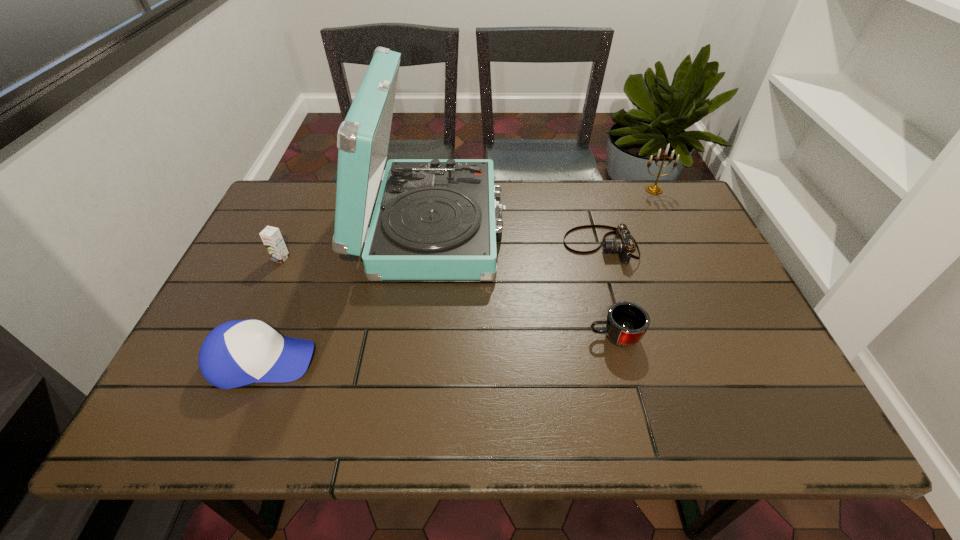
Image resolution: width=960 pixels, height=540 pixels. In order to click on the tallest object in this screenshot , I will do `click(435, 219)`.

Identify the location of the third object from left to right. (x=435, y=219).

The height and width of the screenshot is (540, 960). Identify the location of the fifth shortest object. (652, 189).

Locate an element on the screen. candelabrum is located at coordinates (652, 189).

I want to click on chocolate milk, so click(271, 236).

Locate an element on the screen. The width and height of the screenshot is (960, 540). baseball cap is located at coordinates (236, 353).

Image resolution: width=960 pixels, height=540 pixels. What are the coordinates of `mug` in the screenshot? It's located at (626, 323).

At what (x,y) coordinates should I click in order to perform the action: click on camera. Please return your answer as a coordinate pair (x, y). The height and width of the screenshot is (540, 960). Looking at the image, I should click on (623, 243).

At what (x,y) coordinates should I click in order to perform the action: click on free space located 0.290m on the face side of the fourth object from right to left. Please return your answer as a coordinate pair (x, y). Image resolution: width=960 pixels, height=540 pixels. Looking at the image, I should click on (604, 227).

Locate an element on the screen. The image size is (960, 540). blank space located on the left of the fifth shortest object is located at coordinates (595, 190).